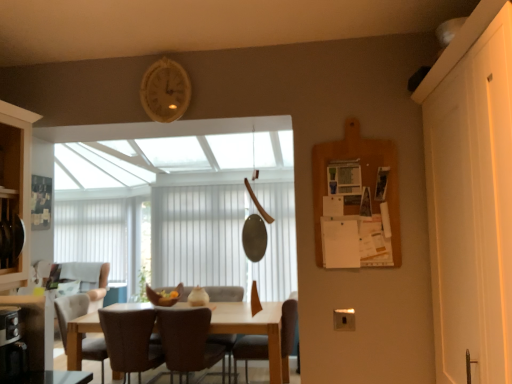
Question: In which direction should I rotate to look at brown leather chair at center, which is counted as the 3th chair, starting from the right?

Choices:
 (A) left
 (B) right

Answer: (A)

Question: Considering the relative sizes of brown leather chair at center, which appears as the fourth chair when viewed from the left, and white vertical blinds at center in the image provided, is brown leather chair at center, which appears as the fourth chair when viewed from the left, thinner than white vertical blinds at center?

Choices:
 (A) yes
 (B) no

Answer: (B)

Question: Is white vertical blinds at center at the back of brown leather chair at center, the first chair positioned from the right?

Choices:
 (A) yes
 (B) no

Answer: (B)

Question: Is brown leather chair at center, the first chair positioned from the right, in contact with white vertical blinds at center?

Choices:
 (A) yes
 (B) no

Answer: (B)

Question: Is brown leather chair at center, the first chair positioned from the right, smaller than white vertical blinds at center?

Choices:
 (A) yes
 (B) no

Answer: (A)

Question: Is brown leather chair at center, which appears as the fourth chair when viewed from the left, not close to white vertical blinds at center?

Choices:
 (A) yes
 (B) no

Answer: (A)

Question: Considering the relative positions of brown leather chair at center, the first chair positioned from the right, and white vertical blinds at center in the image provided, is brown leather chair at center, the first chair positioned from the right, behind white vertical blinds at center?

Choices:
 (A) no
 (B) yes

Answer: (A)

Question: Is white vertical blinds at center positioned behind brown leather chair at center, acting as the 2th chair starting from the right?

Choices:
 (A) yes
 (B) no

Answer: (A)

Question: Would you say white vertical blinds at center is outside brown leather chair at center, which is the third chair in left-to-right order?

Choices:
 (A) no
 (B) yes

Answer: (B)

Question: Are white vertical blinds at center and brown leather chair at center, which is the third chair in left-to-right order, located far from each other?

Choices:
 (A) yes
 (B) no

Answer: (A)

Question: From a real-world perspective, is white vertical blinds at center on top of brown leather chair at center, acting as the 2th chair starting from the right?

Choices:
 (A) no
 (B) yes

Answer: (B)

Question: Can you confirm if white vertical blinds at center is smaller than brown leather chair at center, which is the third chair in left-to-right order?

Choices:
 (A) yes
 (B) no

Answer: (B)

Question: From the image's perspective, is white vertical blinds at center located above brown leather chair at center, which is the third chair in left-to-right order?

Choices:
 (A) yes
 (B) no

Answer: (A)

Question: From a real-world perspective, is brown leather chair at center, acting as the 2th chair starting from the right, over white/textured blind at center?

Choices:
 (A) yes
 (B) no

Answer: (B)